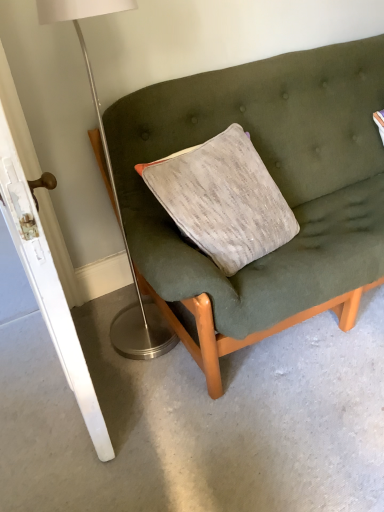
Question: Does textured fabric couch at center lie behind metallic silver floor lamp at left?

Choices:
 (A) yes
 (B) no

Answer: (A)

Question: From the image's perspective, is textured fabric couch at center under metallic silver floor lamp at left?

Choices:
 (A) no
 (B) yes

Answer: (A)

Question: Is textured fabric couch at center facing towards metallic silver floor lamp at left?

Choices:
 (A) no
 (B) yes

Answer: (A)

Question: Considering the relative sizes of textured fabric couch at center and metallic silver floor lamp at left in the image provided, is textured fabric couch at center taller than metallic silver floor lamp at left?

Choices:
 (A) no
 (B) yes

Answer: (A)

Question: Is textured fabric couch at center to the left of metallic silver floor lamp at left from the viewer's perspective?

Choices:
 (A) yes
 (B) no

Answer: (B)

Question: In terms of width, does white glossy door at left look wider or thinner when compared to textured fabric couch at center?

Choices:
 (A) thin
 (B) wide

Answer: (A)

Question: Considering the positions of point (66, 312) and point (349, 70), is point (66, 312) closer or farther from the camera than point (349, 70)?

Choices:
 (A) farther
 (B) closer

Answer: (B)

Question: From a real-world perspective, is white glossy door at left physically located above or below textured fabric couch at center?

Choices:
 (A) above
 (B) below

Answer: (A)

Question: Would you say white glossy door at left is inside or outside textured fabric couch at center?

Choices:
 (A) inside
 (B) outside

Answer: (B)

Question: Is textured fabric couch at center to the left or to the right of metallic silver floor lamp at left in the image?

Choices:
 (A) right
 (B) left

Answer: (A)

Question: From the image's perspective, is textured fabric couch at center above or below metallic silver floor lamp at left?

Choices:
 (A) above
 (B) below

Answer: (A)

Question: Is point (304, 58) closer or farther from the camera than point (157, 331)?

Choices:
 (A) closer
 (B) farther

Answer: (B)

Question: In the image, is textured fabric couch at center positioned in front of or behind metallic silver floor lamp at left?

Choices:
 (A) front
 (B) behind

Answer: (B)

Question: From a real-world perspective, is metallic silver floor lamp at left above or below white glossy door at left?

Choices:
 (A) below
 (B) above

Answer: (A)

Question: Is metallic silver floor lamp at left bigger or smaller than white glossy door at left?

Choices:
 (A) small
 (B) big

Answer: (A)